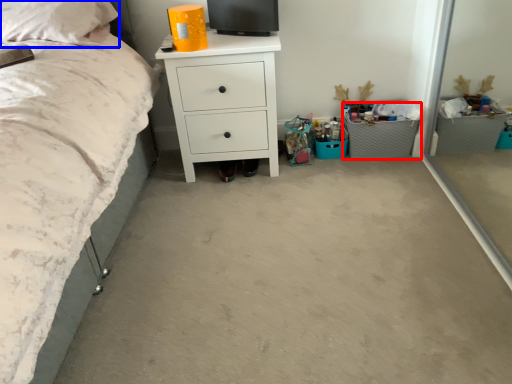
Question: Which object appears farthest to the camera in this image, crate (highlighted by a red box) or pillow (highlighted by a blue box)?

Choices:
 (A) crate
 (B) pillow

Answer: (A)